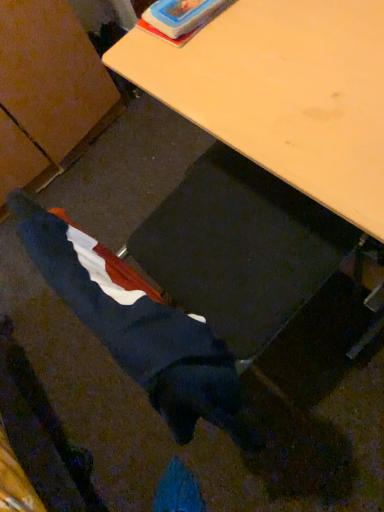
Find the location of a particular element. The height and width of the screenshot is (512, 384). velvet blue coat at lower left is located at coordinates (137, 326).

What do you see at coordinates (137, 326) in the screenshot?
I see `velvet blue coat at lower left` at bounding box center [137, 326].

What do you see at coordinates (283, 93) in the screenshot? I see `wooden desk at center` at bounding box center [283, 93].

This screenshot has width=384, height=512. Find the location of `wooden desk at center`. wooden desk at center is located at coordinates (283, 93).

In order to face wooden desk at center, should I rotate leftwards or rightwards?

It's best to rotate right around 17.025 degrees.

What is the approximate width of wooden desk at center?

It is 19.99 inches.

Image resolution: width=384 pixels, height=512 pixels. I want to click on velvet blue coat at lower left, so click(137, 326).

Looking at this image, visually, is velvet blue coat at lower left positioned to the left or to the right of wooden desk at center?

Based on their positions, velvet blue coat at lower left is located to the left of wooden desk at center.

Which object is further away from the camera, velvet blue coat at lower left or wooden desk at center?

wooden desk at center is further away from the camera.

Between point (183, 329) and point (378, 21), which one is positioned behind?

The point (378, 21) is more distant.

From the image's perspective, is velvet blue coat at lower left beneath wooden desk at center?

Indeed, from the image's perspective, velvet blue coat at lower left is shown beneath wooden desk at center.

From a real-world perspective, which object rests below the other?

From a 3D spatial view, wooden desk at center is below.

In terms of width, does velvet blue coat at lower left look wider or thinner when compared to wooden desk at center?

In the image, velvet blue coat at lower left appears to be more narrow than wooden desk at center.

From their relative heights in the image, would you say velvet blue coat at lower left is taller or shorter than wooden desk at center?

velvet blue coat at lower left is shorter than wooden desk at center.

Does velvet blue coat at lower left have a larger size compared to wooden desk at center?

No, velvet blue coat at lower left is not bigger than wooden desk at center.

Is velvet blue coat at lower left outside of wooden desk at center?

velvet blue coat at lower left lies outside wooden desk at center's area.

Looking at this image, is velvet blue coat at lower left far from wooden desk at center?

They are positioned close to each other.

Could you tell me if velvet blue coat at lower left is facing wooden desk at center?

Yes, velvet blue coat at lower left faces towards wooden desk at center.

How different are the orientations of velvet blue coat at lower left and wooden desk at center in degrees?

180 degrees separate the facing orientations of velvet blue coat at lower left and wooden desk at center.

Identify the location of desk below the velvet blue coat at lower left (from a real-world perspective). The image size is (384, 512). (283, 93).

Is wooden desk at center at the left side of velvet blue coat at lower left?

No, wooden desk at center is not to the left of velvet blue coat at lower left.

From the picture: Considering the positions of objects wooden desk at center and velvet blue coat at lower left in the image provided, who is behind, wooden desk at center or velvet blue coat at lower left?

wooden desk at center is further from the camera.

Between point (371, 35) and point (147, 344), which one is positioned in front?

The point (147, 344) is closer to the camera.

From the image's perspective, between wooden desk at center and velvet blue coat at lower left, who is located below?

velvet blue coat at lower left.

From a real-world perspective, is wooden desk at center physically above velvet blue coat at lower left?

No.

Considering the sizes of objects wooden desk at center and velvet blue coat at lower left in the image provided, who is thinner, wooden desk at center or velvet blue coat at lower left?

velvet blue coat at lower left.

Between wooden desk at center and velvet blue coat at lower left, which one has more height?

wooden desk at center is taller.

Does wooden desk at center have a smaller size compared to velvet blue coat at lower left?

Actually, wooden desk at center might be larger than velvet blue coat at lower left.

Is wooden desk at center not within velvet blue coat at lower left?

Yes, wooden desk at center is located beyond the bounds of velvet blue coat at lower left.

Is wooden desk at center beside velvet blue coat at lower left?

They are not placed beside each other.

Looking at this image, does wooden desk at center turn towards velvet blue coat at lower left?

Yes, wooden desk at center is turned towards velvet blue coat at lower left.

How many degrees apart are the facing directions of wooden desk at center and velvet blue coat at lower left?

There is a 180-degree angle between the facing directions of wooden desk at center and velvet blue coat at lower left.

Measure the distance between wooden desk at center and velvet blue coat at lower left.

wooden desk at center and velvet blue coat at lower left are 12.90 inches apart.

Where is `desk on the right of velvet blue coat at lower left`? desk on the right of velvet blue coat at lower left is located at coordinates (283, 93).

Locate an element on the screen. This screenshot has height=512, width=384. woman located above the wooden desk at center (from a real-world perspective) is located at coordinates (137, 326).

This screenshot has width=384, height=512. In the image, there is a velvet blue coat at lower left. Identify the location of desk above it (from the image's perspective). (283, 93).